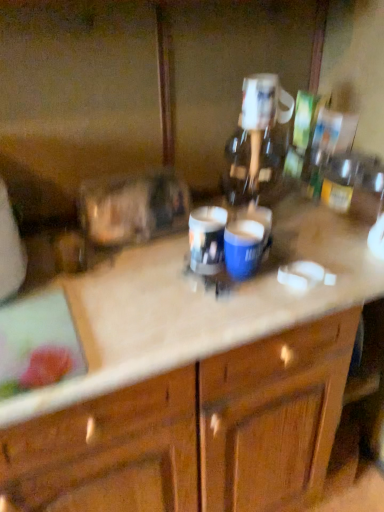
The height and width of the screenshot is (512, 384). Identify the location of vacant region to the right of matte plastic cup at center, arranged as the second beverage when viewed from the right. click(308, 268).